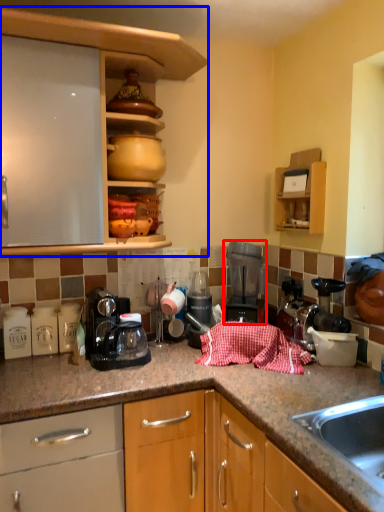
Question: Which of the following is the closest to the observer, kitchen appliance (highlighted by a red box) or cabinetry (highlighted by a blue box)?

Choices:
 (A) kitchen appliance
 (B) cabinetry

Answer: (B)